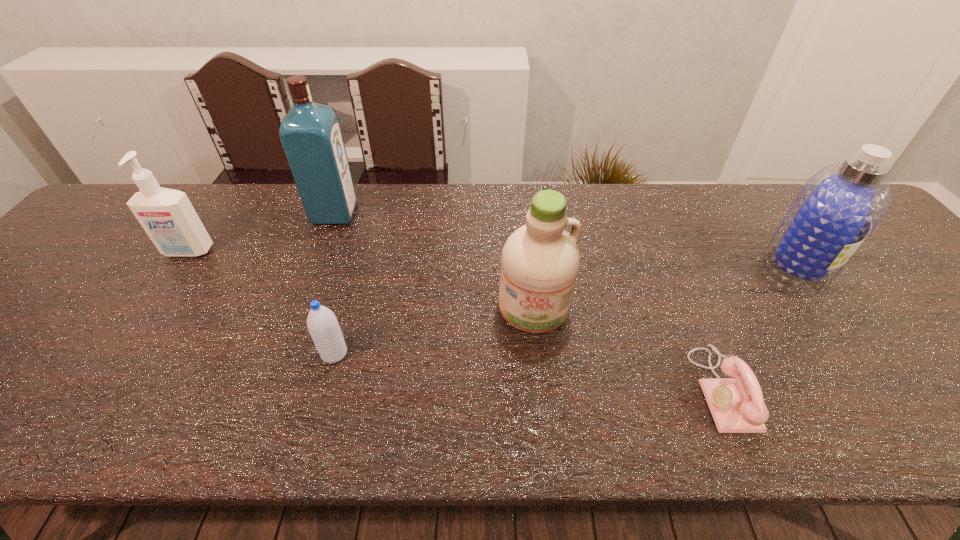
Locate an element on the screen. The width and height of the screenshot is (960, 540). free space that satisfies the following two spatial constraints: 1. on the flat label side of the farthest object; 2. on the front label of the leftmost cleansing agent is located at coordinates (321, 252).